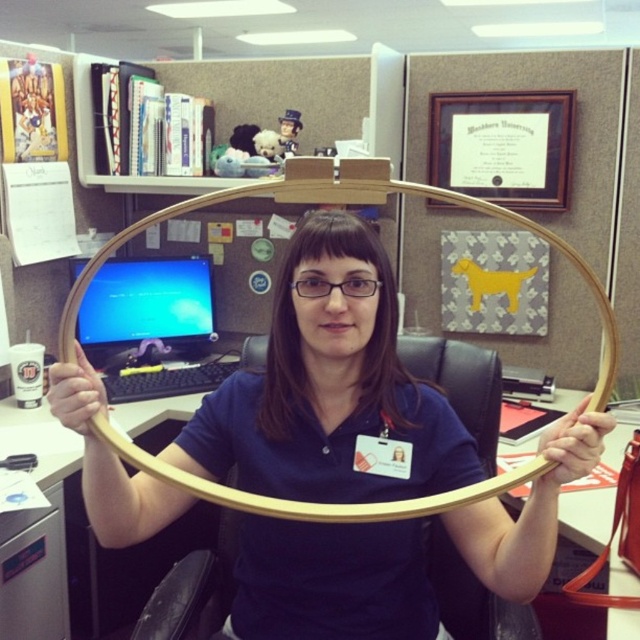
Is matte gold hoop at center smaller than blue glossy monitor at center?

Actually, matte gold hoop at center might be larger than blue glossy monitor at center.

Is matte gold hoop at center taller than blue glossy monitor at center?

Yes.

Is point (420, 573) positioned in front of point (113, 292)?

That is True.

You are a GUI agent. You are given a task and a screenshot of the screen. Output one action in this format:
    pyautogui.click(x=<x>, y=<y>)
    Task: Click on the matte gold hoop at center
    The height and width of the screenshot is (640, 640).
    Given the screenshot: What is the action you would take?
    pyautogui.click(x=326, y=385)